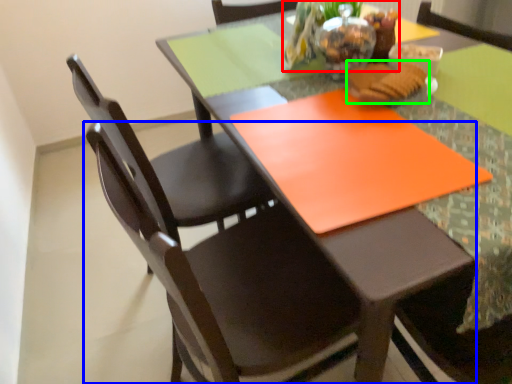
Question: Based on their relative distances, which object is farther from floral arrangement (highlighted by a red box)? Choose from chair (highlighted by a blue box) and food (highlighted by a green box).

Choices:
 (A) chair
 (B) food

Answer: (A)